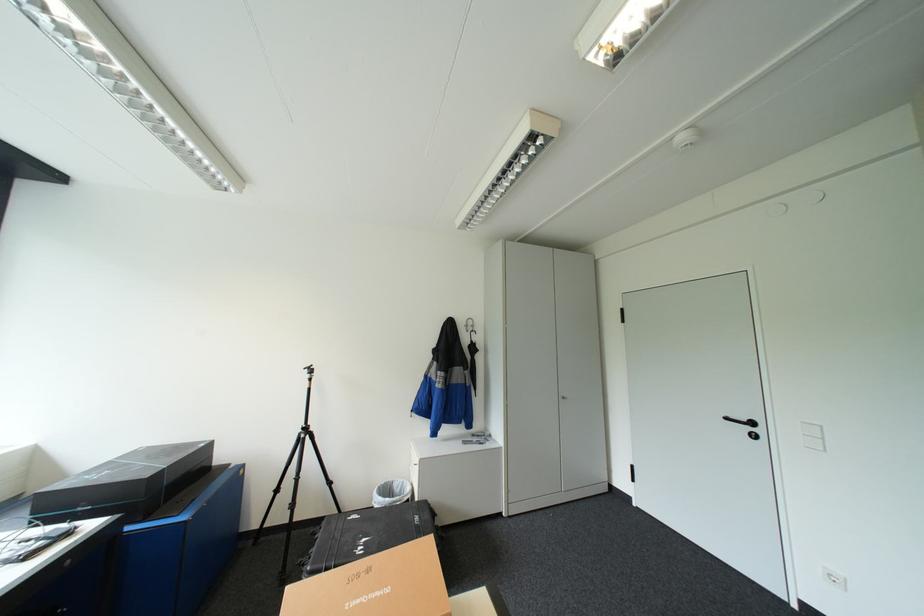
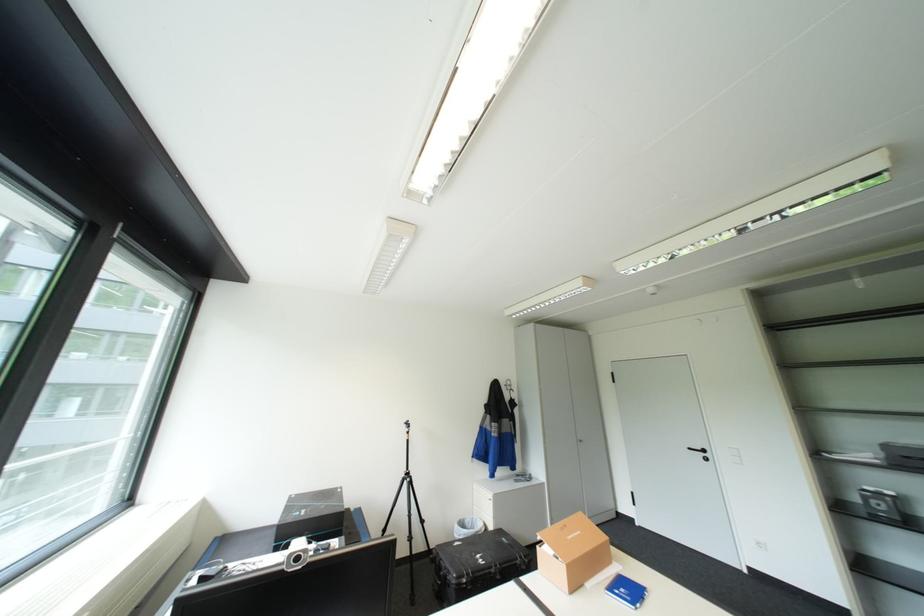
What movement of the cameraman would produce the second image?

The movement direction of the cameraman is left, backward.